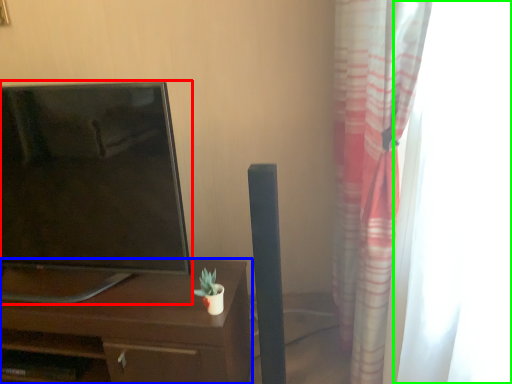
Question: Which object is the closest to the television (highlighted by a red box)? Choose among these: desk (highlighted by a blue box) or glass door (highlighted by a green box).

Choices:
 (A) desk
 (B) glass door

Answer: (A)